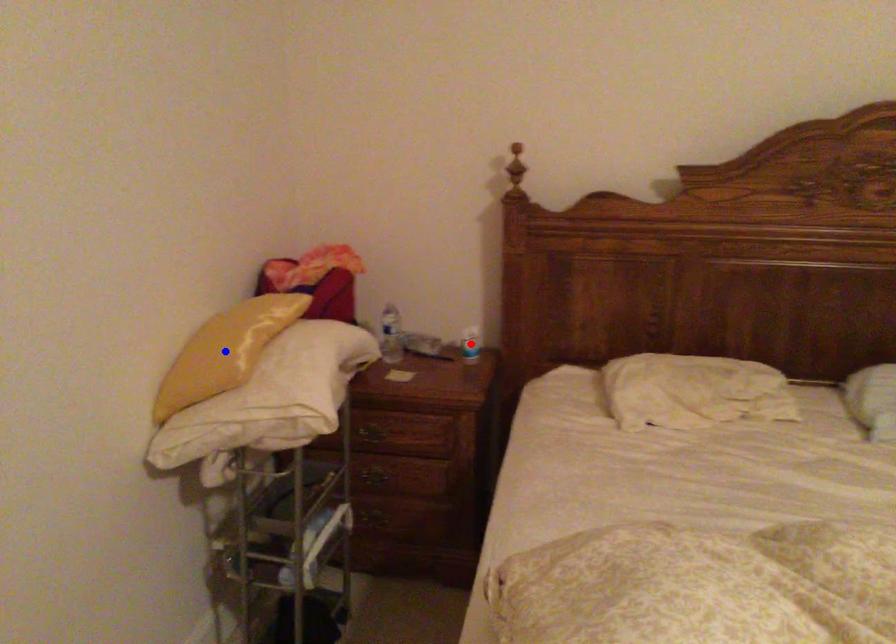
Question: In the image, two points are highlighted. Which point is nearer to the camera? Reply with the corresponding letter.

Choices:
 (A) blue point
 (B) red point

Answer: (A)